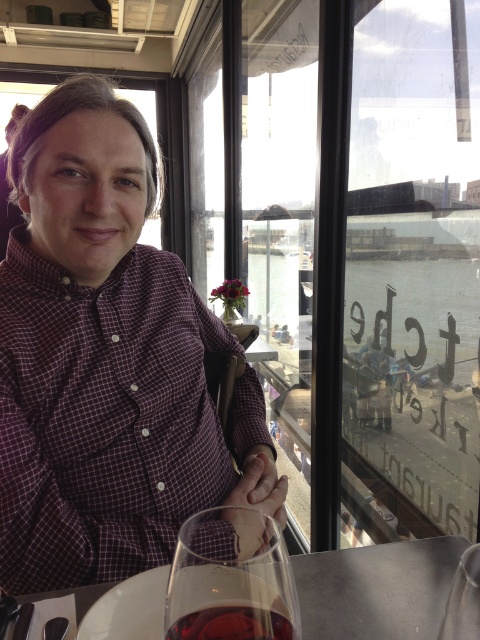
Question: Does purple checkered shirt at center have a smaller size compared to translucent glass wine glass at lower center?

Choices:
 (A) no
 (B) yes

Answer: (A)

Question: Which of the following is the farthest from the observer?

Choices:
 (A) translucent glass wine at lower center
 (B) purple checkered shirt at center
 (C) white glossy table at center

Answer: (B)

Question: Is the position of white glossy table at center more distant than that of translucent glass wine glass at lower center?

Choices:
 (A) yes
 (B) no

Answer: (A)

Question: Does translucent glass wine glass at lower center appear over translucent glass wine at lower center?

Choices:
 (A) no
 (B) yes

Answer: (B)

Question: Which object is the farthest from the white glossy table at center?

Choices:
 (A) translucent glass wine glass at lower center
 (B) purple checkered shirt at center
 (C) translucent glass wine at lower center

Answer: (B)

Question: Considering the real-world distances, which object is closest to the translucent glass wine glass at lower center?

Choices:
 (A) purple checkered shirt at center
 (B) white glossy table at center

Answer: (B)